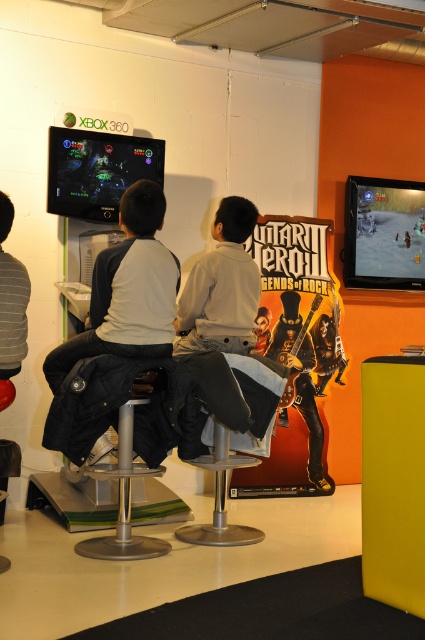
Question: Is shiny black monitor at upper left below silver metallic bar stool at center?

Choices:
 (A) no
 (B) yes

Answer: (A)

Question: Which point is farther to the camera?

Choices:
 (A) (19, 301)
 (B) (214, 428)
 (C) (67, 208)
 (D) (175, 278)

Answer: (C)

Question: Among these objects, which one is nearest to the camera?

Choices:
 (A) striped sweater at center
 (B) silver metallic bar stool at center
 (C) shiny black monitor at upper left
 (D) dark gray fabric jacket at left

Answer: (A)

Question: Which point appears farthest from the camera in this image?

Choices:
 (A) (90, 132)
 (B) (152, 320)

Answer: (A)

Question: Does shiny black monitor at upper left appear over striped sweater at center?

Choices:
 (A) no
 (B) yes

Answer: (B)

Question: Does dark gray fabric jacket at left appear under silver metallic bar stool at center?

Choices:
 (A) yes
 (B) no

Answer: (B)